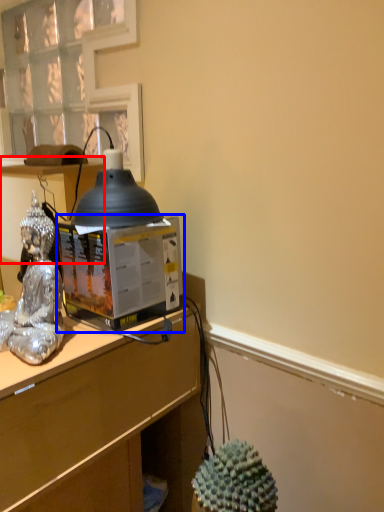
Question: Which point is closer to the camera, vanity (highlighted by a red box) or desktop computer (highlighted by a blue box)?

Choices:
 (A) vanity
 (B) desktop computer

Answer: (B)